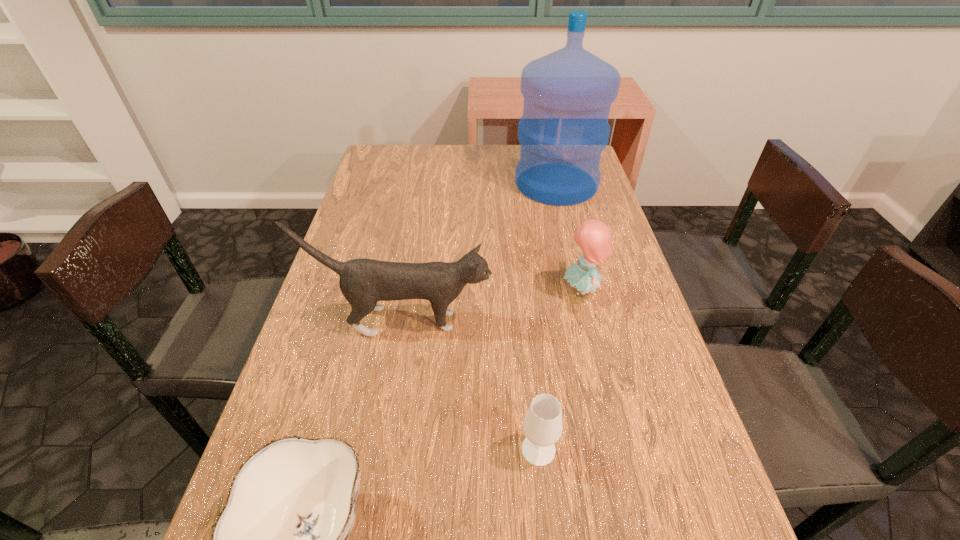
I want to click on water jug, so click(568, 93).

Find the location of `the farthest object`. the farthest object is located at coordinates (568, 93).

You are a GUI agent. You are given a task and a screenshot of the screen. Output one action in this format:
    pyautogui.click(x=<x>, y=<y>)
    Task: Click on the cat
    This screenshot has width=960, height=540.
    Given the screenshot: What is the action you would take?
    click(363, 282)

In order to click on the third tallest object in this screenshot , I will do `click(593, 237)`.

Find the location of a particular element. The image size is (960, 540). the second nearest object is located at coordinates (543, 427).

In order to click on vacant space located on the front of the farthest object in this screenshot , I will do `click(575, 261)`.

This screenshot has height=540, width=960. Find the location of `free space located 0.120m at the face of the cat`. free space located 0.120m at the face of the cat is located at coordinates (543, 321).

Locate an element on the screen. vacant space located 0.060m on the front-facing side of the doll is located at coordinates (537, 291).

Where is `vacant position located on the front-facing side of the doll`? The width and height of the screenshot is (960, 540). vacant position located on the front-facing side of the doll is located at coordinates (467, 291).

This screenshot has width=960, height=540. Identify the location of vacant area situated 0.380m on the front-facing side of the doll. (404, 291).